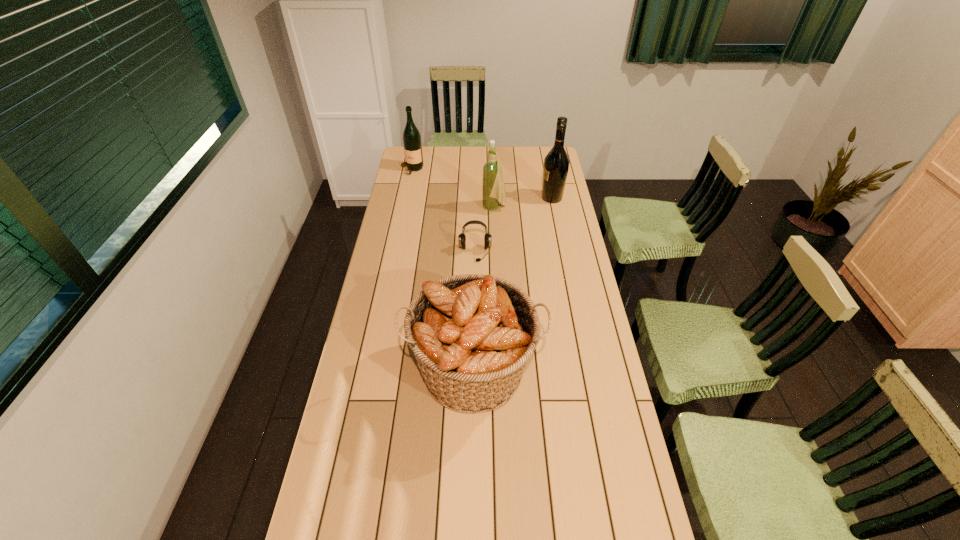
This screenshot has width=960, height=540. I want to click on vacant area that lies between the leftmost wine bottle and the second nearest object, so click(444, 211).

Point out which object is positioned as the second nearest to the second wine bottle from right to left. Please provide its 2D coordinates. Your answer should be formatted as a tuple, i.e. [(x, y)], where the tuple contains the x and y coordinates of a point satisfying the conditions above.

[(462, 238)]

Locate an element on the screen. object that is the fourth closest to the tallest wine bottle is located at coordinates (472, 334).

Identify which wine bottle is located as the nearest to the leftmost object. Please provide its 2D coordinates. Your answer should be formatted as a tuple, i.e. [(x, y)], where the tuple contains the x and y coordinates of a point satisfying the conditions above.

[(493, 192)]

Locate which wine bottle ranks third in proximity to the nearest object. Please provide its 2D coordinates. Your answer should be formatted as a tuple, i.e. [(x, y)], where the tuple contains the x and y coordinates of a point satisfying the conditions above.

[(412, 143)]

This screenshot has width=960, height=540. I want to click on free region that satisfies the following two spatial constraints: 1. on the label of the tallest wine bottle; 2. with the microphone on the side of the headset, so click(x=563, y=253).

This screenshot has height=540, width=960. What are the coordinates of `vacant area that satisfies the following two spatial constraints: 1. on the label of the rightmost object; 2. with the microphone on the side of the fourth farthest object` in the screenshot? It's located at (563, 253).

The height and width of the screenshot is (540, 960). I want to click on free space that satisfies the following two spatial constraints: 1. on the label of the rightmost object; 2. with the microphone on the side of the second nearest object, so click(563, 253).